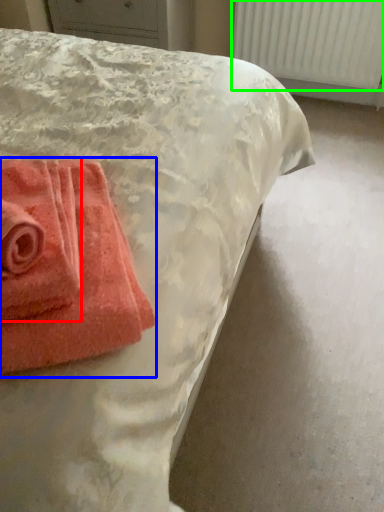
Question: Based on their relative distances, which object is nearer to towel (highlighted by a red box)? Choose from towel (highlighted by a blue box) and radiator (highlighted by a green box).

Choices:
 (A) towel
 (B) radiator

Answer: (A)